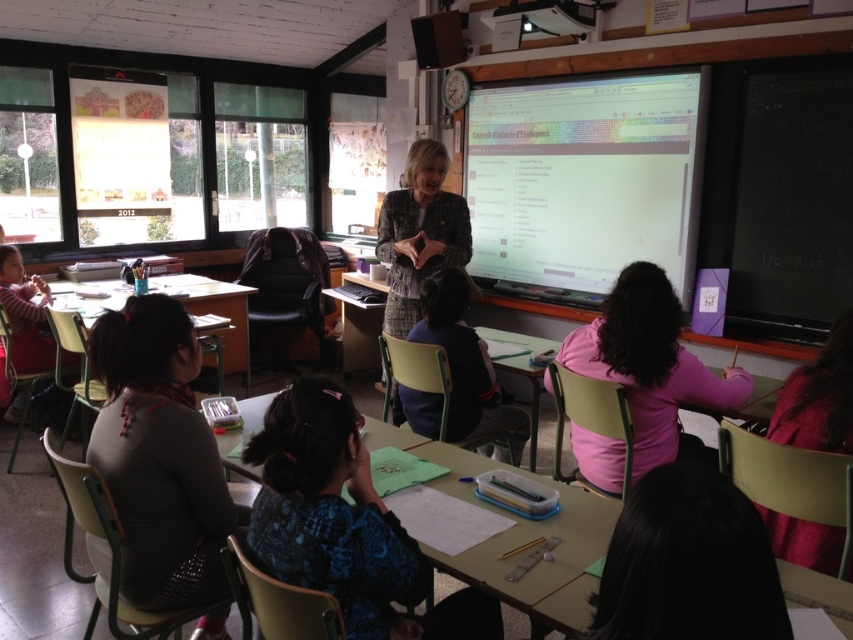
Question: Observing the image, what is the correct spatial positioning of pink matte sweater at center in reference to wooden desk at center?

Choices:
 (A) left
 (B) right

Answer: (B)

Question: Can you confirm if patterned fabric jacket at center is bigger than dark blue fabric at center?

Choices:
 (A) no
 (B) yes

Answer: (A)

Question: Which point is closer to the camera?

Choices:
 (A) (486, 372)
 (B) (389, 428)
 (C) (158, 381)
 (D) (651, 390)

Answer: (C)

Question: Is patterned fabric jacket at center thinner than wooden desk at center?

Choices:
 (A) no
 (B) yes

Answer: (B)

Question: Among these objects, which one is nearest to the camera?

Choices:
 (A) dark gray sweater at center
 (B) pink matte sweater at center
 (C) wooden desk at center

Answer: (C)

Question: Which of the following is the closest to the observer?

Choices:
 (A) patterned fabric jacket at center
 (B) dark blue fabric at center

Answer: (B)